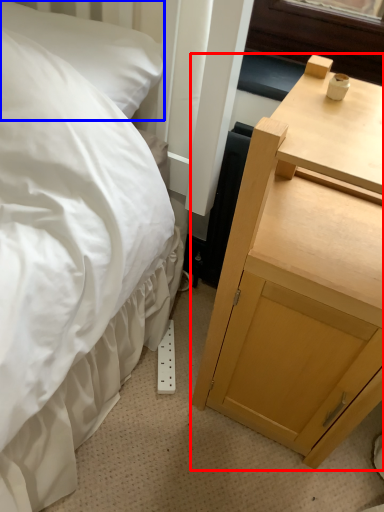
Question: Which object is closer to the camera taking this photo, nightstand (highlighted by a red box) or pillow (highlighted by a blue box)?

Choices:
 (A) nightstand
 (B) pillow

Answer: (A)